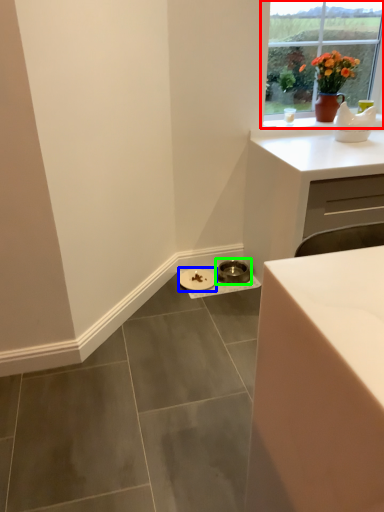
Question: Considering the real-world distances, which object is farthest from window (highlighted by a red box)? manhole cover (highlighted by a blue box) or manhole cover (highlighted by a green box)?

Choices:
 (A) manhole cover
 (B) manhole cover

Answer: (A)